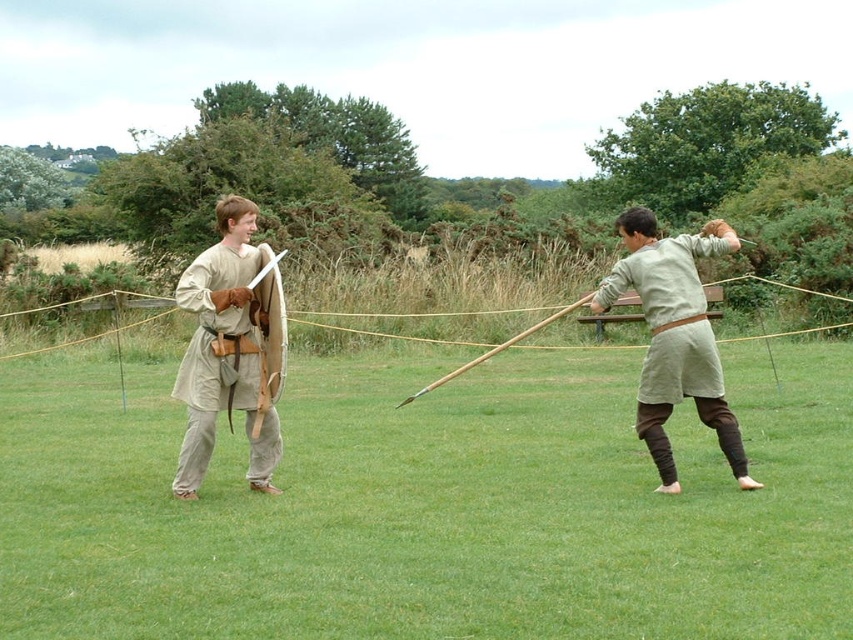
You are a photographer standing in the field and want to take a photo of both the light beige fabric shirt at left and the light beige fabric shirt at right in the same frame. The camera you are using has a maximum focus range of 10 feet. Can you capture both shirts in focus without moving your position?

The light beige fabric shirt at left is 9.72 feet away from the light beige fabric shirt at right. Since the distance between them is within the camera s 10 feet maximum focus range, you can capture both shirts in focus without moving.

From the picture: You are a photographer positioned at the back of the field. You want to capture a clear photo of both the green grass at center and the light beige fabric shirt at right. Based on their positions, which object will appear closer to the camera in the photo?

The green grass at center will appear closer to the camera because it is positioned in front of the light beige fabric shirt at right.